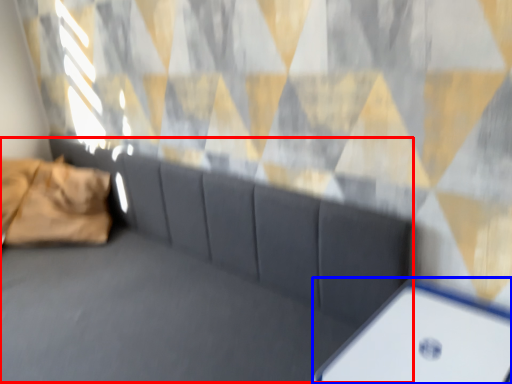
Question: Which object is further to the camera taking this photo, couch (highlighted by a red box) or furniture (highlighted by a blue box)?

Choices:
 (A) couch
 (B) furniture

Answer: (B)